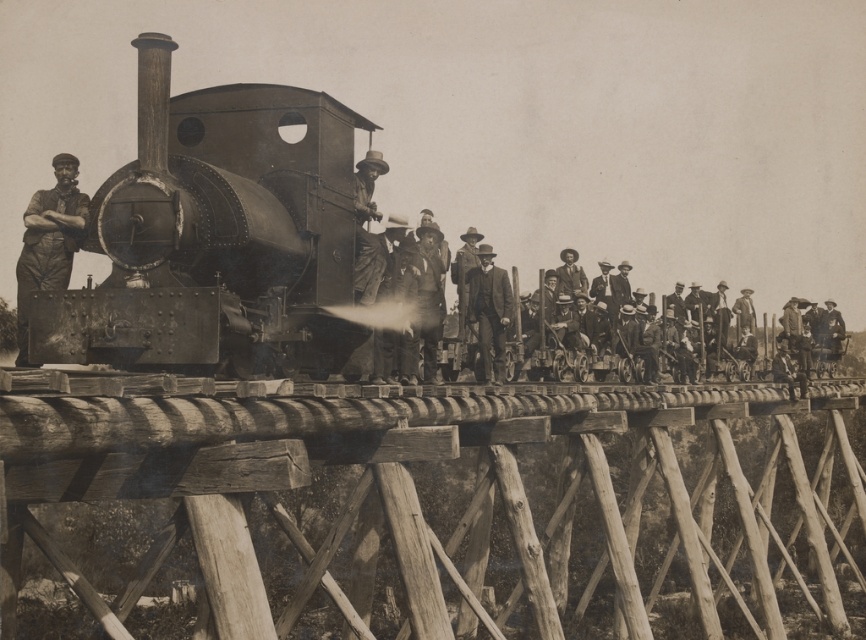
Is matte black steam locomotive at center closer to camera compared to rusty metal man at center?

Yes, it is in front of rusty metal man at center.

Measure the distance between matte black steam locomotive at center and rusty metal man at center.

matte black steam locomotive at center and rusty metal man at center are 3.88 meters apart from each other.

Does point (191, 320) come behind point (40, 257)?

No.

You are a GUI agent. You are given a task and a screenshot of the screen. Output one action in this format:
    pyautogui.click(x=<x>, y=<y>)
    Task: Click on the matte black steam locomotive at center
    The width and height of the screenshot is (866, 640).
    Given the screenshot: What is the action you would take?
    pyautogui.click(x=218, y=236)

Is polished metal locomotive at center below matte black steam locomotive at center?

No.

Which is behind, point (198, 308) or point (273, 154)?

Positioned behind is point (273, 154).

You are a GUI agent. You are given a task and a screenshot of the screen. Output one action in this format:
    pyautogui.click(x=<x>, y=<y>)
    Task: Click on the polished metal locomotive at center
    The height and width of the screenshot is (640, 866).
    Given the screenshot: What is the action you would take?
    pyautogui.click(x=216, y=236)

Can you confirm if matte black steam locomotive at center is taller than smooth brown suit at center?

Yes, matte black steam locomotive at center is taller than smooth brown suit at center.

Consider the image. Which is more to the right, matte black steam locomotive at center or smooth brown suit at center?

smooth brown suit at center is more to the right.

Where is `matte black steam locomotive at center`? The width and height of the screenshot is (866, 640). matte black steam locomotive at center is located at coordinates (218, 236).